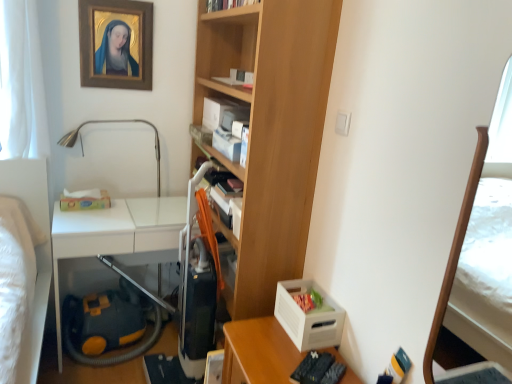
In order to face wooden picture frame at upper left, should I rotate leftwards or rightwards?

To align with it, rotate left about 18.001°.

What is the approximate width of wooden bookcase at center?

wooden bookcase at center is 12.02 inches in width.

The height and width of the screenshot is (384, 512). Find the location of `yellow-orange plastic vacuum cleaner at lower left`. yellow-orange plastic vacuum cleaner at lower left is located at coordinates coord(115,234).

What do you see at coordinates (258, 352) in the screenshot? I see `wooden desk at lower right` at bounding box center [258, 352].

This screenshot has height=384, width=512. Identify the location of wooden picture frame at upper left. (116, 44).

Relative to wooden desk at lower right, is white sheer curtain at left in front or behind?

→ Visually, white sheer curtain at left is located behind wooden desk at lower right.

Considering the sizes of white sheer curtain at left and wooden desk at lower right in the image, is white sheer curtain at left wider or thinner than wooden desk at lower right?

white sheer curtain at left is thinner than wooden desk at lower right.

Based on the photo, can you confirm if white sheer curtain at left is shorter than wooden desk at lower right?

No.

Where is `bookcase in front of the wooden picture frame at upper left`? bookcase in front of the wooden picture frame at upper left is located at coordinates (270, 132).

Is point (305, 141) positioned after point (129, 16)?

That is False.

Are wooden bookcase at center and wooden picture frame at upper left located far from each other?

Absolutely, wooden bookcase at center is distant from wooden picture frame at upper left.

Between wooden bookcase at center and wooden picture frame at upper left, which one has smaller width?

wooden picture frame at upper left is thinner.

Does wooden bookcase at center come in front of yellow-orange plastic vacuum cleaner at lower left?

Yes, wooden bookcase at center is closer to the camera.

Where is `table beneath the wooden bookcase at center (from a real-world perspective)`? Image resolution: width=512 pixels, height=384 pixels. table beneath the wooden bookcase at center (from a real-world perspective) is located at coordinates (115, 234).

Can you see wooden bookcase at center touching yellow-orange plastic vacuum cleaner at lower left?

wooden bookcase at center is not next to yellow-orange plastic vacuum cleaner at lower left, and they're not touching.

From the picture: Is wooden bookcase at center at the right side of yellow-orange plastic vacuum cleaner at lower left?

Indeed, wooden bookcase at center is positioned on the right side of yellow-orange plastic vacuum cleaner at lower left.

Does yellow-orange plastic vacuum cleaner at lower left contain wooden picture frame at upper left?

That's incorrect, wooden picture frame at upper left is not inside yellow-orange plastic vacuum cleaner at lower left.

Is yellow-orange plastic vacuum cleaner at lower left positioned with its back to wooden picture frame at upper left?

yellow-orange plastic vacuum cleaner at lower left is not turned away from wooden picture frame at upper left.

Does point (165, 247) come in front of point (133, 81)?

That is True.

Which object is closer to the camera, yellow-orange plastic vacuum cleaner at lower left or wooden picture frame at upper left?

yellow-orange plastic vacuum cleaner at lower left is closer to the camera.

Does wooden bookcase at center have a lesser height compared to white sheer curtain at left?

In fact, wooden bookcase at center may be taller than white sheer curtain at left.

Which object is closer to the camera, wooden bookcase at center or white sheer curtain at left?

wooden bookcase at center is more forward.

Where is `curtain above the wooden bookcase at center (from a real-world perspective)`? curtain above the wooden bookcase at center (from a real-world perspective) is located at coordinates (21, 83).

Which of these two, wooden bookcase at center or white sheer curtain at left, is wider?

wooden bookcase at center.

Would you say yellow-orange plastic vacuum cleaner at lower left is a long distance from white sheer curtain at left?

No, yellow-orange plastic vacuum cleaner at lower left is not far away from white sheer curtain at left.

Consider the image. Does yellow-orange plastic vacuum cleaner at lower left appear on the left side of white sheer curtain at left?

In fact, yellow-orange plastic vacuum cleaner at lower left is to the right of white sheer curtain at left.

What's the angular difference between yellow-orange plastic vacuum cleaner at lower left and white sheer curtain at left's facing directions?

The facing directions of yellow-orange plastic vacuum cleaner at lower left and white sheer curtain at left are 2.52 degrees apart.

Where is `desk on the right of yellow-orange plastic vacuum cleaner at lower left`? desk on the right of yellow-orange plastic vacuum cleaner at lower left is located at coordinates (258, 352).

Considering the sizes of objects yellow-orange plastic vacuum cleaner at lower left and wooden desk at lower right in the image provided, who is wider, yellow-orange plastic vacuum cleaner at lower left or wooden desk at lower right?

yellow-orange plastic vacuum cleaner at lower left is wider.

Relative to wooden desk at lower right, is yellow-orange plastic vacuum cleaner at lower left in front or behind?

Result: yellow-orange plastic vacuum cleaner at lower left is positioned farther from the viewer than wooden desk at lower right.

Are yellow-orange plastic vacuum cleaner at lower left and wooden desk at lower right making contact?

No.

You are a GUI agent. You are given a task and a screenshot of the screen. Output one action in this format:
    pyautogui.click(x=<x>, y=<y>)
    Task: Click on the curtain on the left side of wooden desk at lower right
    The width and height of the screenshot is (512, 384).
    Given the screenshot: What is the action you would take?
    pyautogui.click(x=21, y=83)

I want to click on picture frame located above the wooden bookcase at center (from a real-world perspective), so click(116, 44).

Which object lies nearer to the anchor point wooden desk at lower right, yellow-orange plastic vacuum cleaner at lower left or wooden picture frame at upper left?

yellow-orange plastic vacuum cleaner at lower left.

When comparing their distances from white sheer curtain at left, does wooden bookcase at center or wooden picture frame at upper left seem further?

wooden bookcase at center is positioned further to the anchor white sheer curtain at left.

Estimate the real-world distances between objects in this image. Which object is closer to white sheer curtain at left, wooden desk at lower right or wooden bookcase at center?

Among the two, wooden bookcase at center is located nearer to white sheer curtain at left.

Looking at the image, which one is located further to wooden bookcase at center, yellow-orange plastic vacuum cleaner at lower left or wooden desk at lower right?

Based on the image, yellow-orange plastic vacuum cleaner at lower left appears to be further to wooden bookcase at center.

When comparing their distances from wooden picture frame at upper left, does white sheer curtain at left or wooden desk at lower right seem closer?

white sheer curtain at left lies closer to wooden picture frame at upper left than the other object.

Which object lies further to the anchor point wooden picture frame at upper left, white sheer curtain at left or wooden bookcase at center?

wooden bookcase at center.

Consider the image. When comparing their distances from wooden bookcase at center, does wooden desk at lower right or wooden picture frame at upper left seem closer?

wooden desk at lower right is closer to wooden bookcase at center.

Which object lies nearer to the anchor point wooden picture frame at upper left, wooden bookcase at center or wooden desk at lower right?

wooden bookcase at center is positioned closer to the anchor wooden picture frame at upper left.

Where is `picture frame located between white sheer curtain at left and wooden bookcase at center in the left-right direction`? The width and height of the screenshot is (512, 384). picture frame located between white sheer curtain at left and wooden bookcase at center in the left-right direction is located at coordinates point(116,44).

Where is `table between white sheer curtain at left and wooden desk at lower right vertically`? Image resolution: width=512 pixels, height=384 pixels. table between white sheer curtain at left and wooden desk at lower right vertically is located at coordinates (115, 234).

This screenshot has height=384, width=512. I want to click on bookcase between wooden picture frame at upper left and wooden desk at lower right vertically, so click(270, 132).

Find the location of `table between white sheer curtain at left and wooden bookcase at center`. table between white sheer curtain at left and wooden bookcase at center is located at coordinates (115, 234).